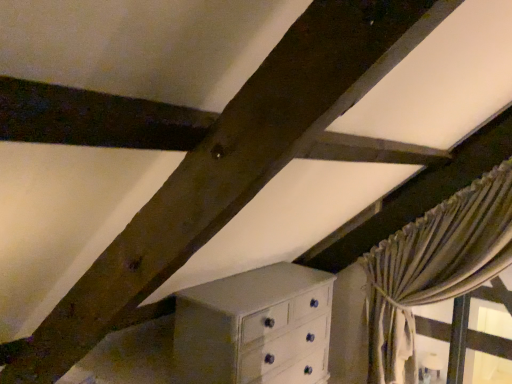
Where is `white painted wood chest of drawers at lower center`? The image size is (512, 384). white painted wood chest of drawers at lower center is located at coordinates (253, 327).

What do you see at coordinates (253, 327) in the screenshot? Image resolution: width=512 pixels, height=384 pixels. I see `white painted wood chest of drawers at lower center` at bounding box center [253, 327].

Image resolution: width=512 pixels, height=384 pixels. What do you see at coordinates (434, 267) in the screenshot?
I see `silky beige curtain at right` at bounding box center [434, 267].

Measure the distance between point (453, 270) and camera.

They are 2.43 meters apart.

This screenshot has height=384, width=512. What are the coordinates of `silky beige curtain at right` in the screenshot? It's located at (434, 267).

Locate an element on the screen. The image size is (512, 384). white painted wood chest of drawers at lower center is located at coordinates (253, 327).

Considering the positions of objects silky beige curtain at right and white painted wood chest of drawers at lower center in the image provided, who is more to the left, silky beige curtain at right or white painted wood chest of drawers at lower center?

Positioned to the left is white painted wood chest of drawers at lower center.

Is silky beige curtain at right further to the viewer compared to white painted wood chest of drawers at lower center?

Yes, it is behind white painted wood chest of drawers at lower center.

Which is closer, (377, 324) or (208, 285)?

Point (208, 285)

From the image's perspective, is silky beige curtain at right positioned above or below white painted wood chest of drawers at lower center?

A: silky beige curtain at right is situated higher than white painted wood chest of drawers at lower center in the image.

Looking at this image, from a real-world perspective, is silky beige curtain at right physically above white painted wood chest of drawers at lower center?

Yes, from a real-world perspective, silky beige curtain at right is on top of white painted wood chest of drawers at lower center.

Is silky beige curtain at right thinner than white painted wood chest of drawers at lower center?

Yes, silky beige curtain at right is thinner than white painted wood chest of drawers at lower center.

Who is taller, silky beige curtain at right or white painted wood chest of drawers at lower center?

Standing taller between the two is silky beige curtain at right.

Considering the relative sizes of silky beige curtain at right and white painted wood chest of drawers at lower center in the image provided, is silky beige curtain at right bigger than white painted wood chest of drawers at lower center?

Actually, silky beige curtain at right might be smaller than white painted wood chest of drawers at lower center.

Is silky beige curtain at right inside the boundaries of white painted wood chest of drawers at lower center, or outside?

silky beige curtain at right lies outside white painted wood chest of drawers at lower center.

Are silky beige curtain at right and white painted wood chest of drawers at lower center located far from each other?

They are positioned close to each other.

Is silky beige curtain at right turned away from white painted wood chest of drawers at lower center?

No, silky beige curtain at right's orientation is not away from white painted wood chest of drawers at lower center.

Looking at this image, measure the distance between silky beige curtain at right and white painted wood chest of drawers at lower center.

28.81 inches.

Locate an element on the screen. curtain above the white painted wood chest of drawers at lower center (from the image's perspective) is located at coordinates (x=434, y=267).

Based on the photo, considering the relative positions of white painted wood chest of drawers at lower center and silky beige curtain at right in the image provided, is white painted wood chest of drawers at lower center to the right of silky beige curtain at right from the viewer's perspective?

No, white painted wood chest of drawers at lower center is not to the right of silky beige curtain at right.

Does white painted wood chest of drawers at lower center lie in front of silky beige curtain at right?

Yes, white painted wood chest of drawers at lower center is in front of silky beige curtain at right.

Is point (323, 335) closer or farther from the camera than point (373, 314)?

Point (323, 335) is positioned closer to the camera compared to point (373, 314).

From the image's perspective, which is above, white painted wood chest of drawers at lower center or silky beige curtain at right?

silky beige curtain at right.

From a real-world perspective, who is located lower, white painted wood chest of drawers at lower center or silky beige curtain at right?

white painted wood chest of drawers at lower center, from a real-world perspective.

In terms of width, does white painted wood chest of drawers at lower center look wider or thinner when compared to silky beige curtain at right?

Clearly, white painted wood chest of drawers at lower center has more width compared to silky beige curtain at right.

Based on the photo, does white painted wood chest of drawers at lower center have a lesser height compared to silky beige curtain at right?

Yes, white painted wood chest of drawers at lower center is shorter than silky beige curtain at right.

Which of these two, white painted wood chest of drawers at lower center or silky beige curtain at right, is smaller?

Smaller between the two is silky beige curtain at right.

Can silky beige curtain at right be found inside white painted wood chest of drawers at lower center?

No, silky beige curtain at right is not a part of white painted wood chest of drawers at lower center.

Would you say white painted wood chest of drawers at lower center is a long distance from silky beige curtain at right?

No, white painted wood chest of drawers at lower center is in close proximity to silky beige curtain at right.

Is white painted wood chest of drawers at lower center facing towards silky beige curtain at right?

Yes, white painted wood chest of drawers at lower center faces towards silky beige curtain at right.

Measure the distance from white painted wood chest of drawers at lower center to silky beige curtain at right.

white painted wood chest of drawers at lower center and silky beige curtain at right are 28.81 inches apart from each other.

At what (x,y) coordinates should I click in order to perform the action: click on the chest of drawers located underneath the silky beige curtain at right (from a real-world perspective). Please return your answer as a coordinate pair (x, y). The height and width of the screenshot is (384, 512). Looking at the image, I should click on (253, 327).

Where is `the chest of drawers located in front of the silky beige curtain at right`? The width and height of the screenshot is (512, 384). the chest of drawers located in front of the silky beige curtain at right is located at coordinates (253, 327).

What are the coordinates of `curtain above the white painted wood chest of drawers at lower center (from the image's perspective)` in the screenshot? It's located at (434, 267).